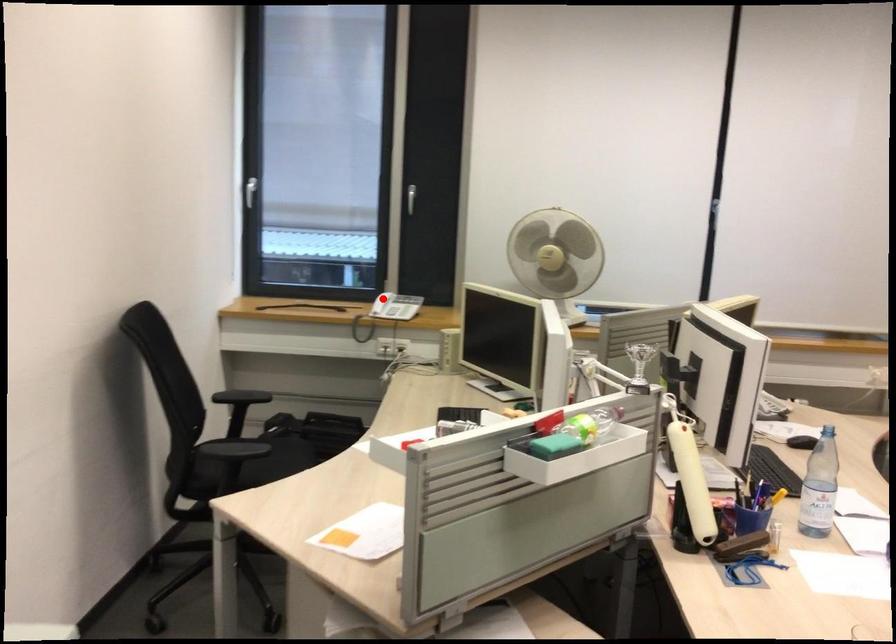
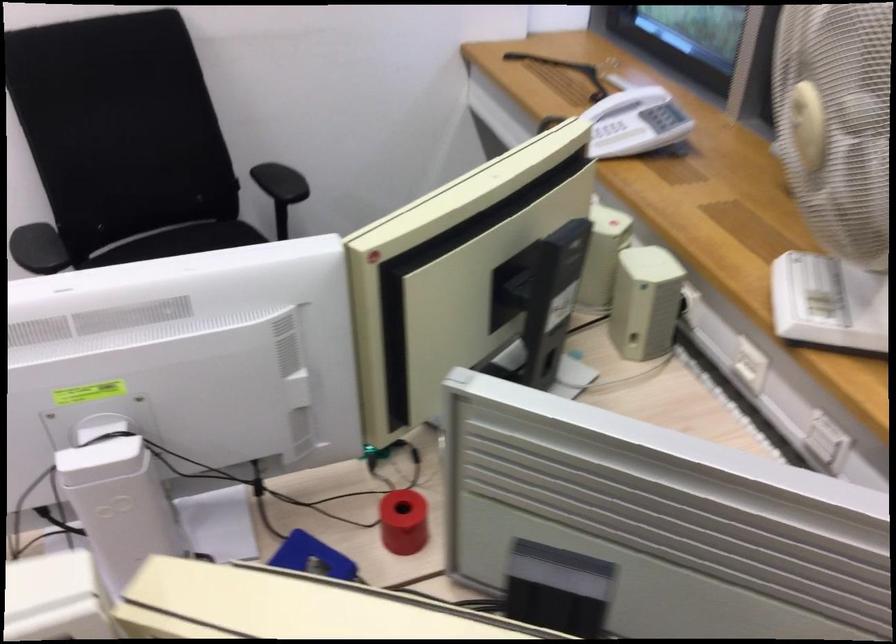
The point at the highlighted location is marked in the first image. Where is the corresponding point in the second image?

(634, 122)